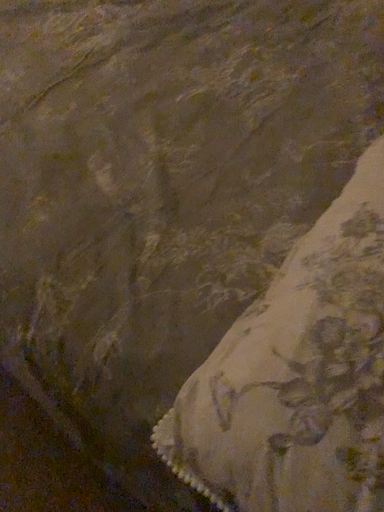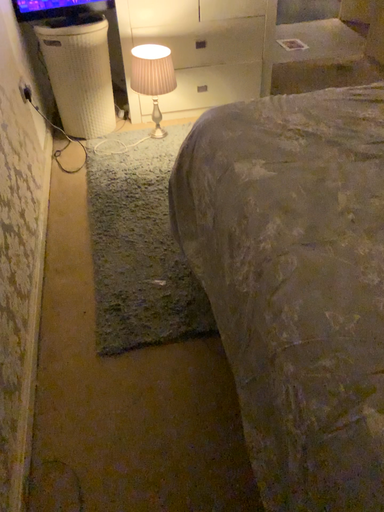
Question: How did the camera likely rotate when shooting the video?

Choices:
 (A) rotated left
 (B) rotated right

Answer: (A)